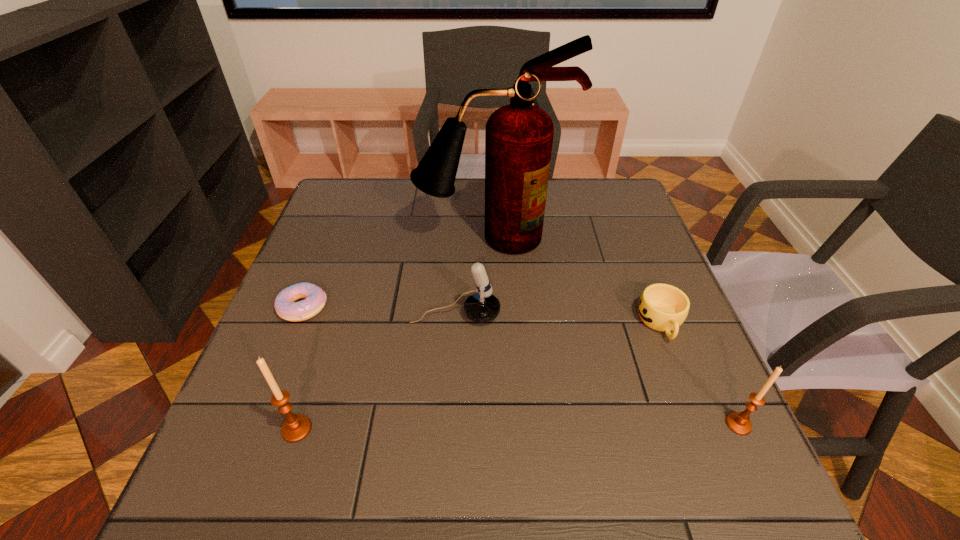
Image resolution: width=960 pixels, height=540 pixels. Identify the location of object that is at the near right corner. (739, 423).

Image resolution: width=960 pixels, height=540 pixels. Find the location of `vacant area at the far edge`. vacant area at the far edge is located at coordinates (423, 204).

Find the location of a particular element. The height and width of the screenshot is (540, 960). vacant area at the near edge is located at coordinates (631, 446).

Identify the location of free space at the left edge of the desktop. (312, 397).

The image size is (960, 540). In the image, there is a desktop. Identify the location of vacant space at the right edge. (684, 335).

I want to click on free point at the far left corner, so click(336, 221).

Locate an element on the screen. This screenshot has height=540, width=960. vacant space at the near left corner of the desktop is located at coordinates (275, 429).

Where is `vacant space at the near right corner of the desktop`? Image resolution: width=960 pixels, height=540 pixels. vacant space at the near right corner of the desktop is located at coordinates (686, 412).

What are the coordinates of `free space between the tallest object and the second shortest object` in the screenshot? It's located at (576, 280).

The width and height of the screenshot is (960, 540). I want to click on free space between the microphone and the doughnut, so click(x=379, y=311).